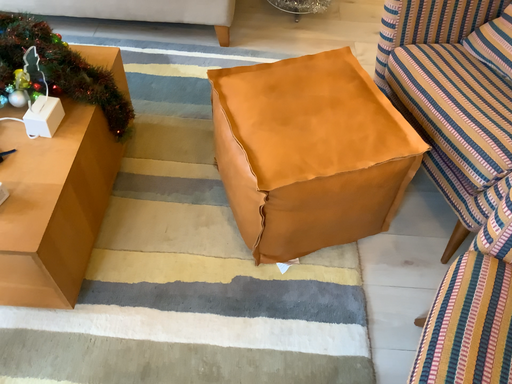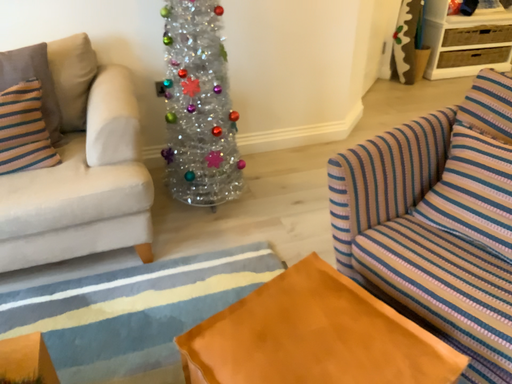
Question: How did the camera likely rotate when shooting the video?

Choices:
 (A) rotated left
 (B) rotated right

Answer: (B)